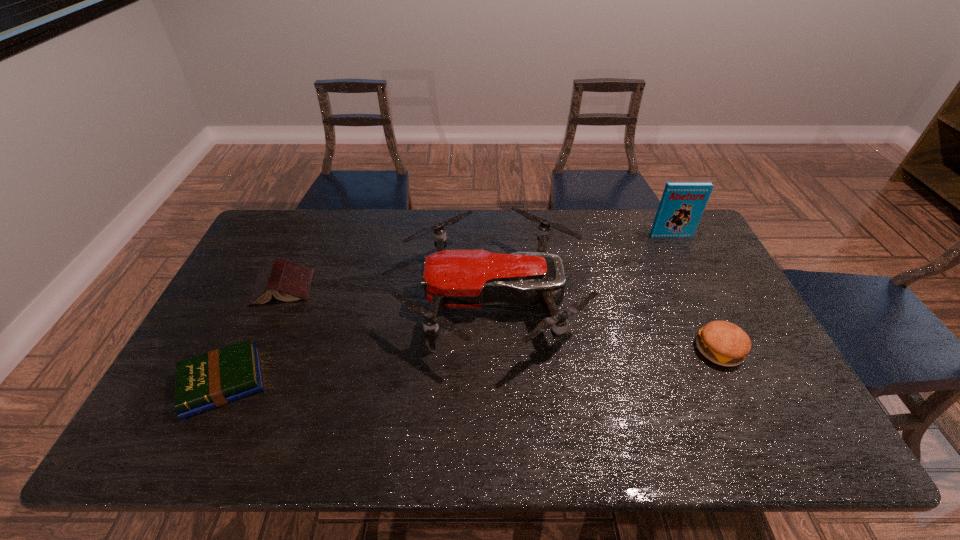
Identify which book is the third nearest to the third shortest object. Please provide its 2D coordinates. Your answer should be formatted as a tuple, i.e. [(x, y)], where the tuple contains the x and y coordinates of a point satisfying the conditions above.

[(213, 379)]

The height and width of the screenshot is (540, 960). Find the location of `free spot that satisfies the following two spatial constraints: 1. on the front-facing side of the fourth shortest object; 2. on the front side of the shortest object`. free spot that satisfies the following two spatial constraints: 1. on the front-facing side of the fourth shortest object; 2. on the front side of the shortest object is located at coordinates (495, 382).

The image size is (960, 540). Identify the location of vacant space that satisfies the following two spatial constraints: 1. on the back side of the fourth tallest object; 2. on the left side of the shortest object. (269, 288).

Find the location of `vacant space that satisfies the following two spatial constraints: 1. on the front cover of the farthest object; 2. on the front-facing side of the fourth shortest object`. vacant space that satisfies the following two spatial constraints: 1. on the front cover of the farthest object; 2. on the front-facing side of the fourth shortest object is located at coordinates (702, 298).

Where is `free space that satisfies the following two spatial constraints: 1. on the front cover of the tallest object; 2. on the front-facing side of the second tallest object`? free space that satisfies the following two spatial constraints: 1. on the front cover of the tallest object; 2. on the front-facing side of the second tallest object is located at coordinates tap(702, 298).